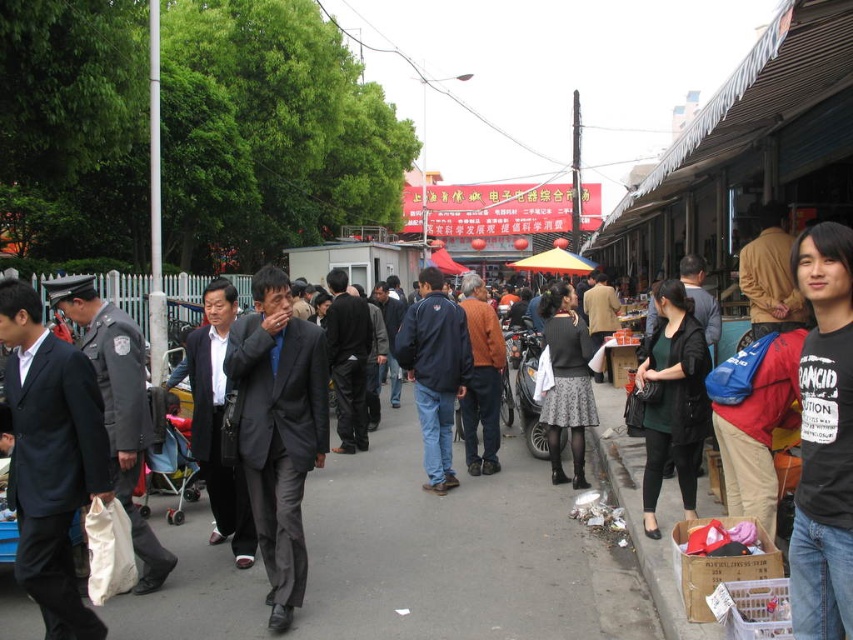
You are standing at the point marked by the coordinates [672,400] in the bustling street market scene. Which object is exactly at this location?

The dark green jersey at center is located at point [672,400].

You are a photographer standing in the bustling street market scene. You notice two people dressed in dark clothing. One is wearing a matte black suit at left and the other has a dark blue jacket at center. Which of these two individuals appears shorter in the image?

The matte black suit at left appears shorter compared to the dark blue jacket at center as it has a lesser height.

You are a photographer trying to capture a candid shot of the dark green jersey at center and the orange knit sweater at center. Since you want to ensure both subjects are in focus, you need to know which one is narrower. Which clothing item is narrower?

The dark green jersey at center is narrower than the orange knit sweater at center.